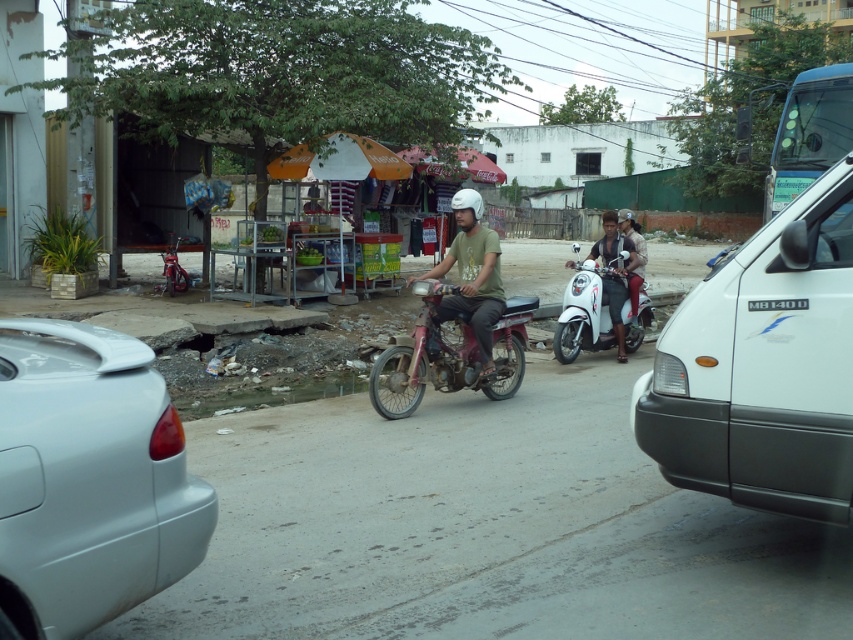
Question: Does white glossy scooter at center come behind matte black scooter at center?

Choices:
 (A) yes
 (B) no

Answer: (B)

Question: Which of these objects is positioned farthest from the rusty metal motorcycle at center?

Choices:
 (A) white glossy scooter at center
 (B) matte green t-shirt at center
 (C) white matte van at right
 (D) white matte car at lower left

Answer: (D)

Question: Which of these objects is positioned farthest from the matte black scooter at center?

Choices:
 (A) white glossy scooter at center
 (B) white matte car at lower left

Answer: (B)

Question: Which point is closer to the camera?

Choices:
 (A) (764, 461)
 (B) (514, 333)
 (C) (636, 280)

Answer: (A)

Question: Is rusty metal motorcycle at center thinner than matte green t-shirt at center?

Choices:
 (A) no
 (B) yes

Answer: (A)

Question: Does white glossy scooter at center appear on the right side of matte black scooter at center?

Choices:
 (A) no
 (B) yes

Answer: (A)